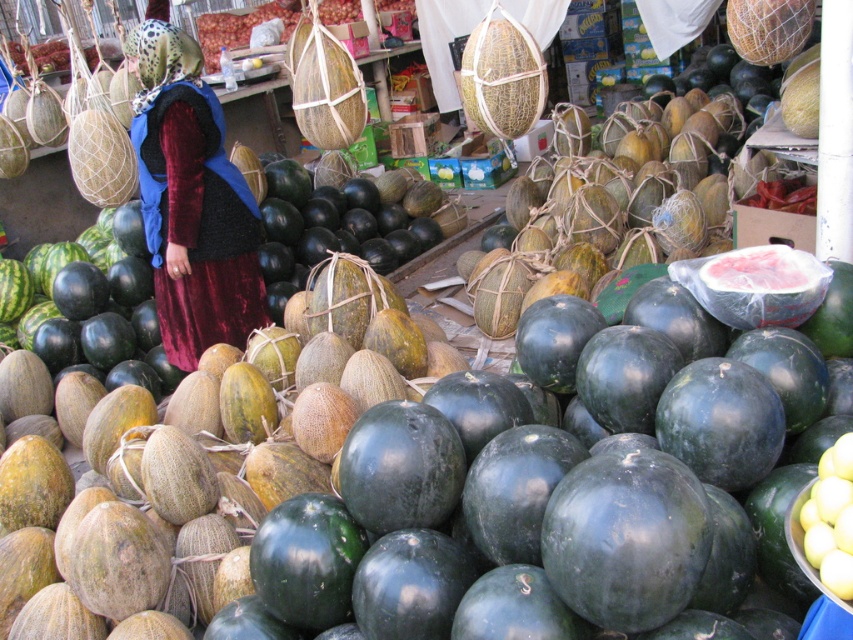
Question: Which of the following is the closest to the observer?

Choices:
 (A) velvet dress at center
 (B) green matte watermelon at center

Answer: (B)

Question: Which point is closer to the camera?

Choices:
 (A) green matte watermelon at center
 (B) velvet dress at center

Answer: (A)

Question: Can you confirm if green matte watermelon at center is positioned to the left of velvet dress at center?

Choices:
 (A) yes
 (B) no

Answer: (B)

Question: Does green matte watermelon at center have a lesser width compared to velvet dress at center?

Choices:
 (A) yes
 (B) no

Answer: (B)

Question: Does green matte watermelon at center appear under velvet dress at center?

Choices:
 (A) yes
 (B) no

Answer: (A)

Question: Which object is closer to the camera taking this photo?

Choices:
 (A) velvet dress at center
 (B) green matte watermelon at center

Answer: (B)